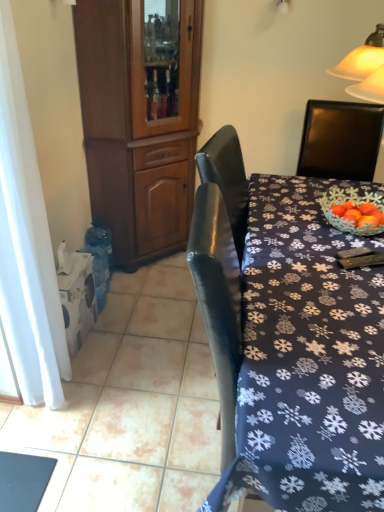
Question: Considering the relative sizes of dark blue fabric tablecloth at center and brown wood cabinet at left in the image provided, is dark blue fabric tablecloth at center bigger than brown wood cabinet at left?

Choices:
 (A) yes
 (B) no

Answer: (B)

Question: Is dark blue fabric tablecloth at center to the left of brown wood cabinet at left from the viewer's perspective?

Choices:
 (A) no
 (B) yes

Answer: (A)

Question: Can you confirm if dark blue fabric tablecloth at center is taller than brown wood cabinet at left?

Choices:
 (A) no
 (B) yes

Answer: (A)

Question: From a real-world perspective, does dark blue fabric tablecloth at center sit lower than brown wood cabinet at left?

Choices:
 (A) no
 (B) yes

Answer: (B)

Question: Can you confirm if dark blue fabric tablecloth at center is smaller than brown wood cabinet at left?

Choices:
 (A) no
 (B) yes

Answer: (B)

Question: Considering the positions of point (14, 129) and point (345, 348), is point (14, 129) closer or farther from the camera than point (345, 348)?

Choices:
 (A) farther
 (B) closer

Answer: (A)

Question: Looking at the image, does white sheer curtain at left seem bigger or smaller compared to dark blue fabric tablecloth at center?

Choices:
 (A) big
 (B) small

Answer: (B)

Question: Considering the positions of white sheer curtain at left and dark blue fabric tablecloth at center in the image, is white sheer curtain at left wider or thinner than dark blue fabric tablecloth at center?

Choices:
 (A) thin
 (B) wide

Answer: (A)

Question: Would you say white sheer curtain at left is to the left or to the right of dark blue fabric tablecloth at center in the picture?

Choices:
 (A) left
 (B) right

Answer: (A)

Question: Is dark blue fabric tablecloth at center to the left or to the right of white sheer curtain at left in the image?

Choices:
 (A) right
 (B) left

Answer: (A)

Question: Considering the positions of point (216, 237) and point (14, 178), is point (216, 237) closer or farther from the camera than point (14, 178)?

Choices:
 (A) closer
 (B) farther

Answer: (A)

Question: From a real-world perspective, is dark blue fabric tablecloth at center positioned above or below white sheer curtain at left?

Choices:
 (A) below
 (B) above

Answer: (A)

Question: Looking at their shapes, would you say dark blue fabric tablecloth at center is wider or thinner than white sheer curtain at left?

Choices:
 (A) thin
 (B) wide

Answer: (B)

Question: Considering the positions of brown wood cabinet at left and dark blue fabric tablecloth at center in the image, is brown wood cabinet at left wider or thinner than dark blue fabric tablecloth at center?

Choices:
 (A) wide
 (B) thin

Answer: (B)

Question: Is brown wood cabinet at left bigger or smaller than dark blue fabric tablecloth at center?

Choices:
 (A) big
 (B) small

Answer: (A)